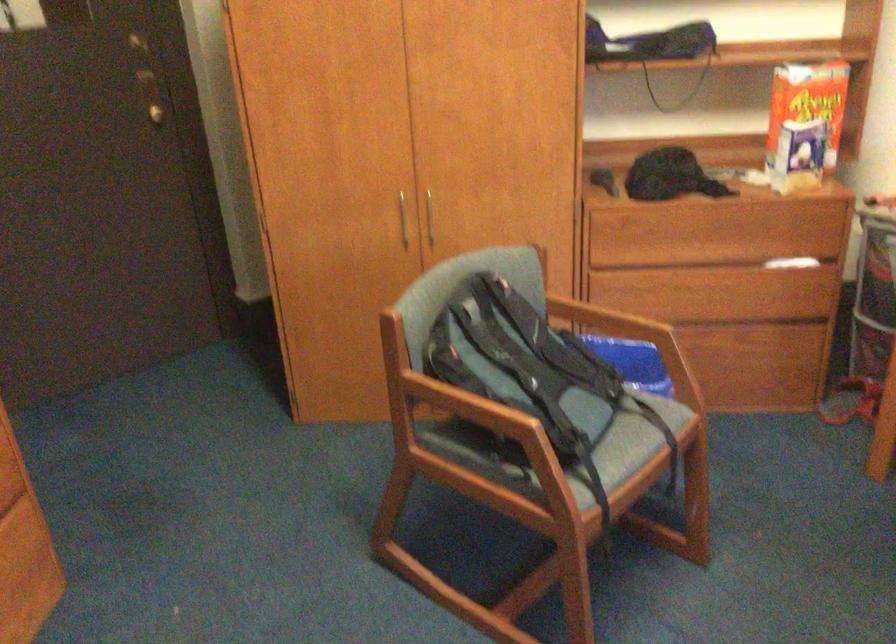
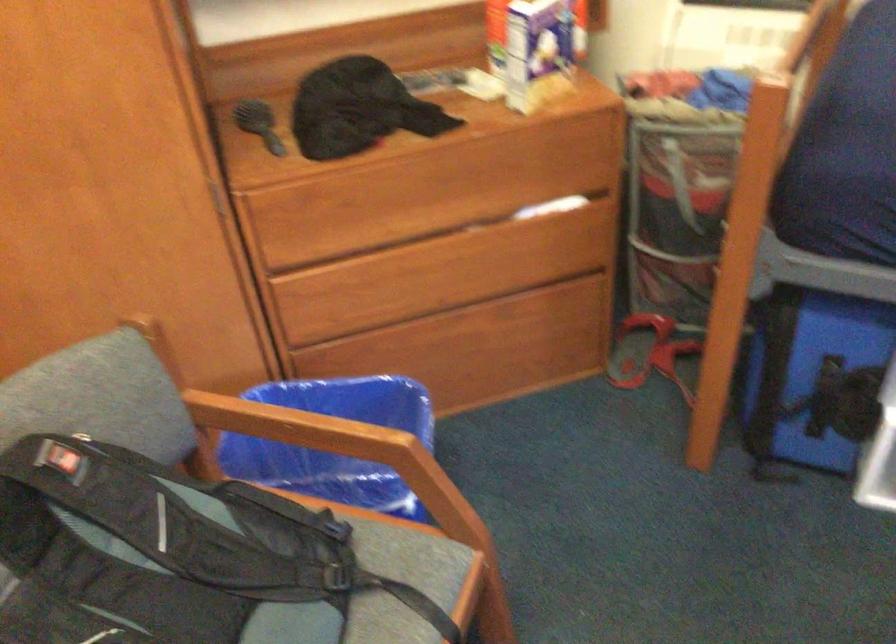
In the second image, find the point that corresponds to [695,267] in the first image.

(420, 238)